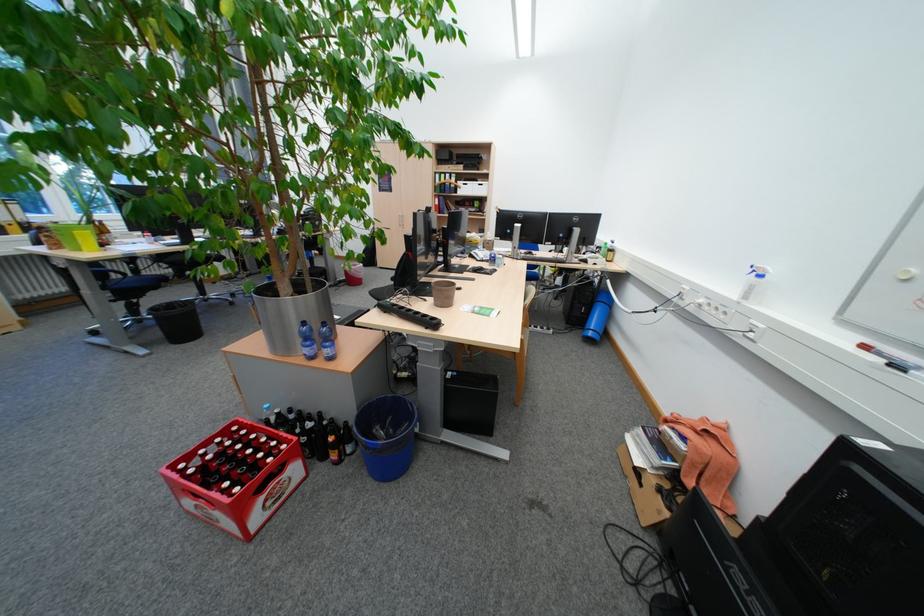
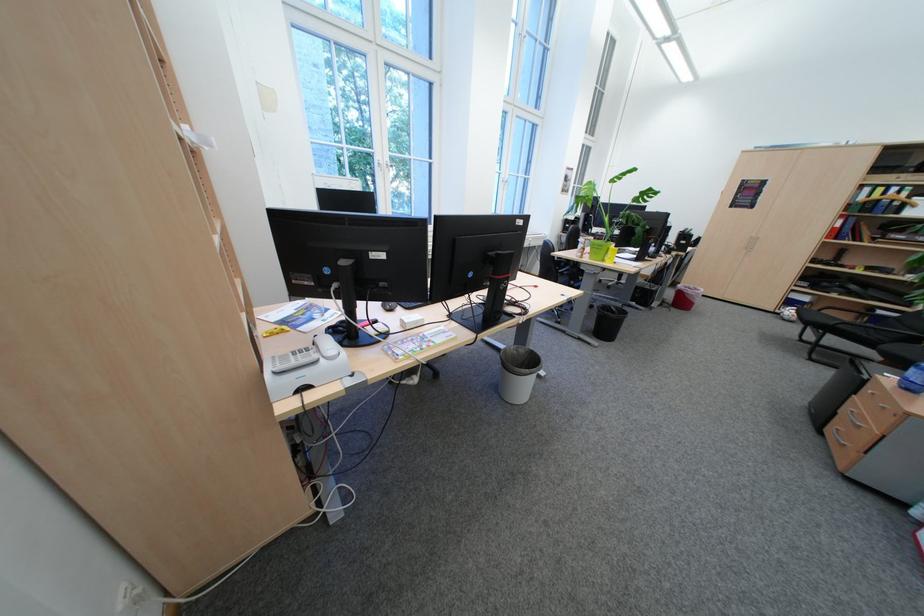
In the second image, find the point that corresponds to [446,175] in the first image.

(873, 188)